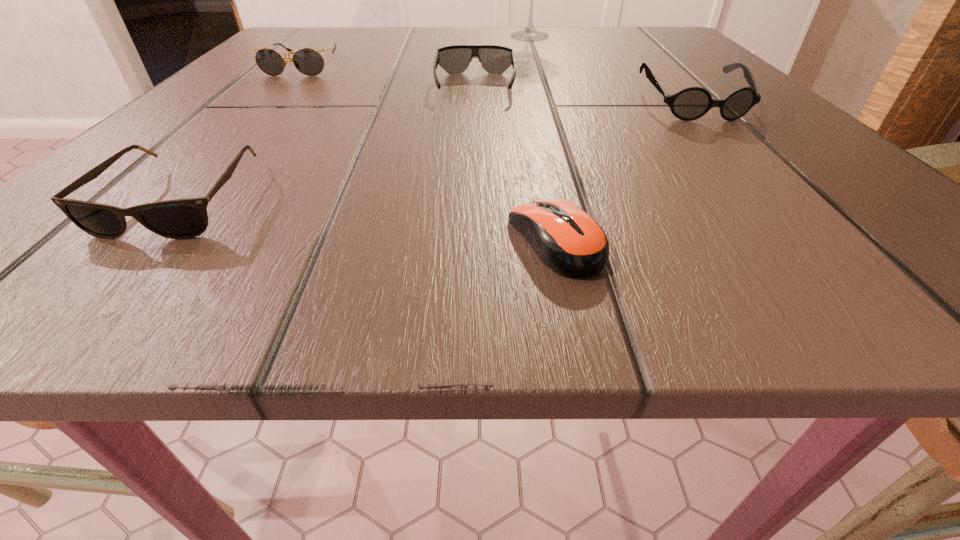
At what (x,y) coordinates should I click in order to perform the action: click on martini at the far edge. Please return your answer as a coordinate pair (x, y). Looking at the image, I should click on (530, 33).

This screenshot has width=960, height=540. In order to click on sunglasses that is at the far edge in this screenshot , I will do `click(308, 61)`.

Identify the location of sunglasses at the near edge. This screenshot has width=960, height=540. (187, 218).

Image resolution: width=960 pixels, height=540 pixels. I want to click on computer mouse situated at the near edge, so click(570, 242).

The image size is (960, 540). I want to click on object situated at the right edge, so tap(691, 103).

This screenshot has height=540, width=960. Find the location of `object at the far left corner`. object at the far left corner is located at coordinates (308, 61).

Locate an element on the screen. object that is at the near left corner is located at coordinates (187, 218).

This screenshot has height=540, width=960. In order to click on free spot at the far edge of the desktop in this screenshot , I will do `click(463, 28)`.

Where is `vacant area at the near edge of the desktop`? vacant area at the near edge of the desktop is located at coordinates (563, 291).

Locate an element on the screen. blank space at the left edge of the desktop is located at coordinates (169, 178).